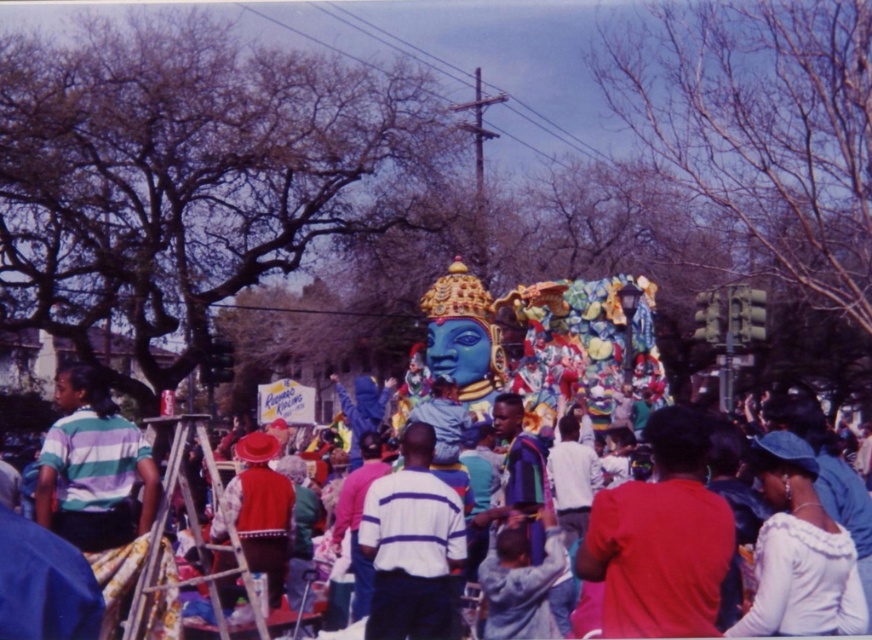
Is red matte shirt at lower right above striped cotton shirt at left?

Incorrect, red matte shirt at lower right is not positioned above striped cotton shirt at left.

Can you confirm if red matte shirt at lower right is thinner than striped cotton shirt at left?

Yes, red matte shirt at lower right is thinner than striped cotton shirt at left.

Who is more forward, (703,632) or (96,435)?

Point (703,632) is more forward.

Where is `red matte shirt at lower right`? This screenshot has width=872, height=640. red matte shirt at lower right is located at coordinates (661, 538).

Who is positioned more to the left, white striped shirt at center or red velvet hat at center?

red velvet hat at center

Does white striped shirt at center have a smaller size compared to red velvet hat at center?

Actually, white striped shirt at center might be larger than red velvet hat at center.

Locate an element on the screen. white striped shirt at center is located at coordinates (412, 545).

Is striped cotton shirt at left closer to the viewer compared to wooden ladder at left?

No, it is not.

Between point (109, 448) and point (171, 420), which one is positioned in front?

Point (171, 420) is in front.

Is point (153, 480) behind point (221, 499)?

No, (153, 480) is closer to viewer.

What are the coordinates of `striped cotton shirt at left` in the screenshot? It's located at (93, 467).